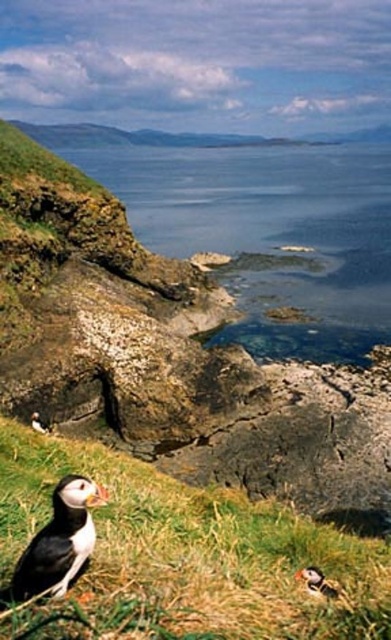
Question: Which is farther from the green grassy at lower left?

Choices:
 (A) clear blue water at center
 (B) multicolored feathered puffin at lower center
 (C) black feathered puffin at lower left

Answer: (A)

Question: Does green grassy at lower left lie in front of multicolored feathered puffin at lower center?

Choices:
 (A) yes
 (B) no

Answer: (A)

Question: Which of the following is the closest to the observer?

Choices:
 (A) (326, 593)
 (B) (371, 305)
 (C) (112, 611)
 (D) (64, 589)

Answer: (C)

Question: Does black and white puffin at lower left appear on the right side of black feathered puffin at lower left?

Choices:
 (A) no
 (B) yes

Answer: (B)

Question: Is green grassy at lower left bigger than multicolored feathered puffin at lower center?

Choices:
 (A) no
 (B) yes

Answer: (A)

Question: Which of the following is the farthest from the observer?

Choices:
 (A) green grassy at lower left
 (B) clear blue water at center
 (C) black and white puffin at lower left
 (D) black feathered puffin at lower left

Answer: (B)